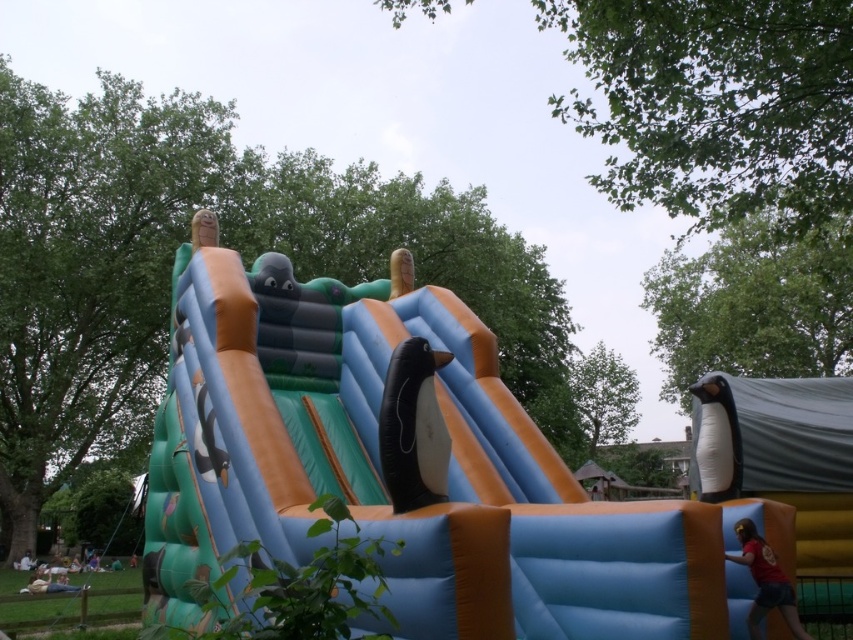
Question: Can you confirm if white matte penguin at right is positioned to the left of red t-shirt at lower right?

Choices:
 (A) no
 (B) yes

Answer: (A)

Question: Which of these objects is positioned farthest from the red t-shirt at lower right?

Choices:
 (A) black rubber penguin at center
 (B) white matte penguin at right

Answer: (A)

Question: Which object is positioned closest to the black rubber penguin at center?

Choices:
 (A) red t-shirt at lower right
 (B) white matte penguin at right

Answer: (A)

Question: Which point is closer to the camera taking this photo?

Choices:
 (A) (735, 424)
 (B) (405, 344)

Answer: (B)

Question: Is black rubber penguin at center smaller than white matte penguin at right?

Choices:
 (A) no
 (B) yes

Answer: (B)

Question: Can you confirm if black rubber penguin at center is positioned above white matte penguin at right?

Choices:
 (A) yes
 (B) no

Answer: (A)